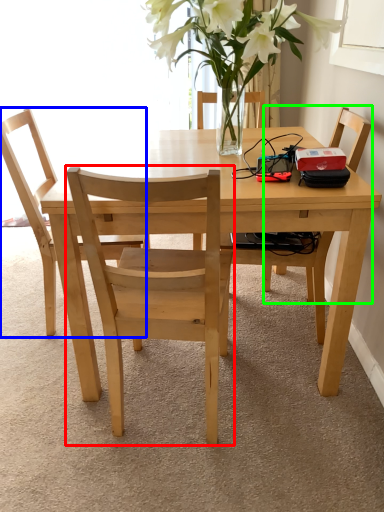
Question: Based on their relative distances, which object is farther from chair (highlighted by a red box)? Choose from chair (highlighted by a blue box) and chair (highlighted by a green box).

Choices:
 (A) chair
 (B) chair

Answer: (B)